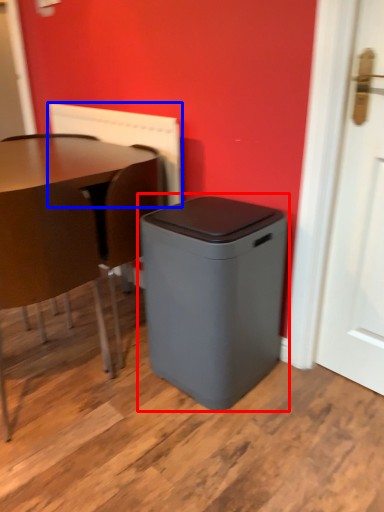
Question: Which object is closer to the camera taking this photo, waste container (highlighted by a red box) or radiator (highlighted by a blue box)?

Choices:
 (A) waste container
 (B) radiator

Answer: (A)